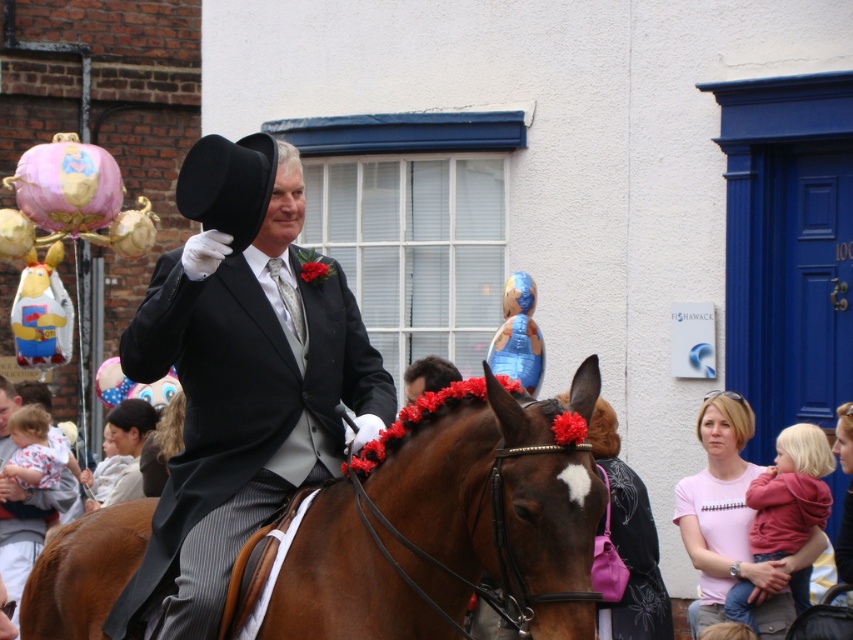
Question: Which point appears closest to the camera in this image?

Choices:
 (A) (384, 472)
 (B) (189, 429)

Answer: (A)

Question: Does brown glossy horse at center have a lesser width compared to matte black top hat at center?

Choices:
 (A) no
 (B) yes

Answer: (A)

Question: Can you confirm if brown glossy horse at center is wider than matte black top hat at center?

Choices:
 (A) no
 (B) yes

Answer: (B)

Question: Does brown glossy horse at center appear under matte black top hat at center?

Choices:
 (A) no
 (B) yes

Answer: (B)